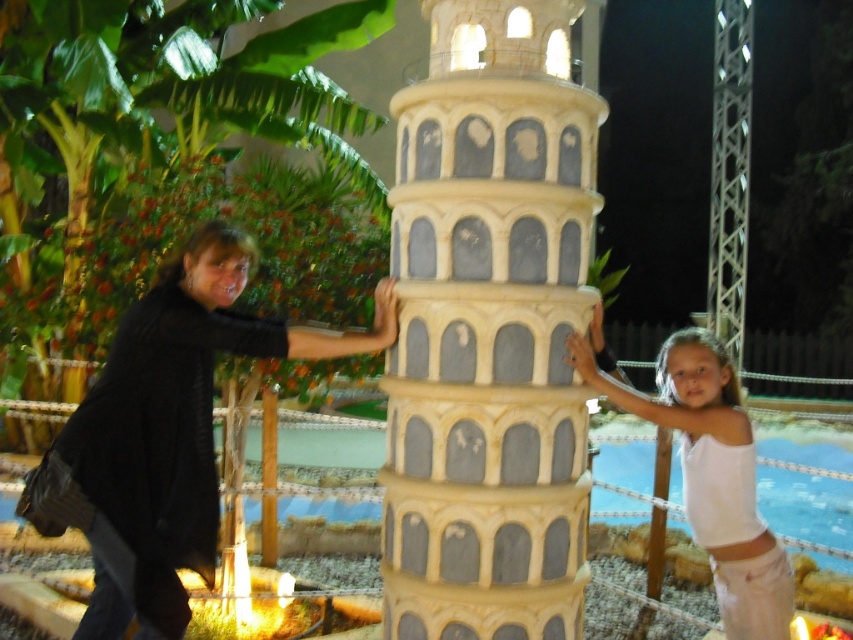
Between black matte shirt at left and white cotton tank top at center, which one has less height?

With less height is white cotton tank top at center.

Can you confirm if black matte shirt at left is positioned above white cotton tank top at center?

Correct, black matte shirt at left is located above white cotton tank top at center.

Image resolution: width=853 pixels, height=640 pixels. In order to click on black matte shirt at left in this screenshot , I will do (x=165, y=433).

What do you see at coordinates (489, 330) in the screenshot? I see `stone-like tower at center` at bounding box center [489, 330].

Does point (556, 102) come in front of point (740, 493)?

Yes, point (556, 102) is in front of point (740, 493).

Locate an element on the screen. stone-like tower at center is located at coordinates (x=489, y=330).

Is stone-like tower at center wider than black matte shirt at left?

Incorrect, stone-like tower at center's width does not surpass black matte shirt at left's.

Is stone-like tower at center in front of black matte shirt at left?

Yes, stone-like tower at center is closer to the viewer.

Does point (503, 49) lie in front of point (125, 445)?

No, (503, 49) is further to viewer.

Identify the location of stone-like tower at center. The width and height of the screenshot is (853, 640). (489, 330).